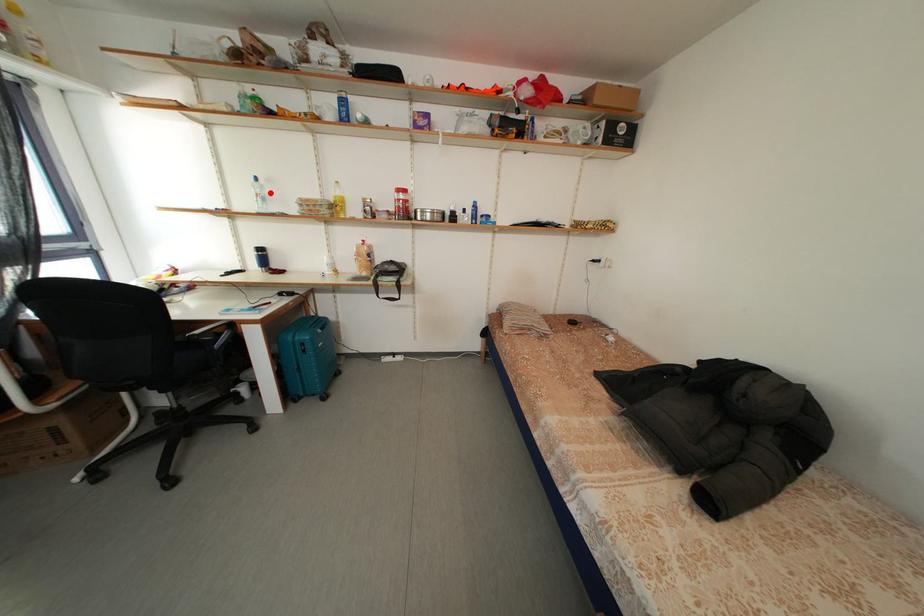
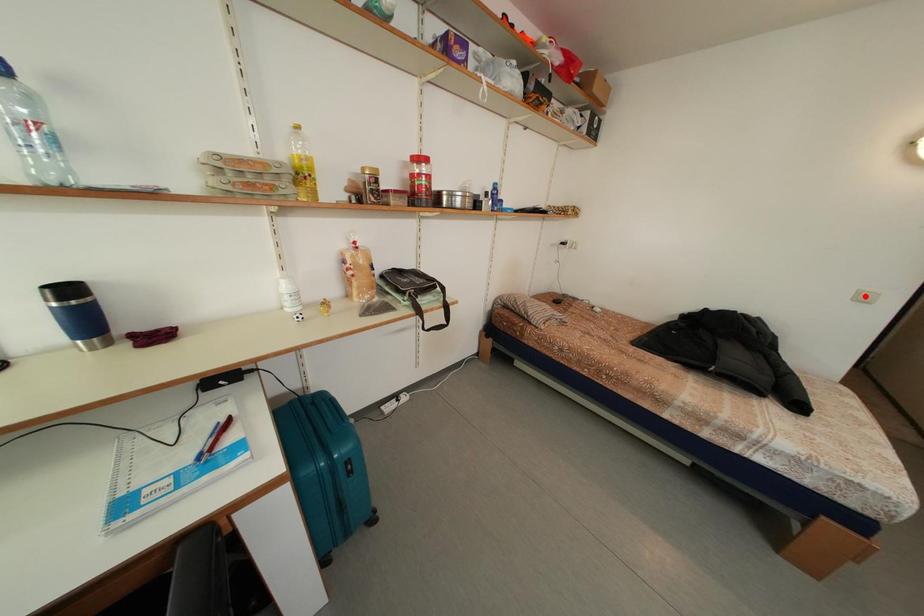
I am providing you with two images of the same scene from different viewpoints. A red point is marked on the first image and another point is marked on the second image. Is the red point in image1 aligned with the point shown in image2?

No